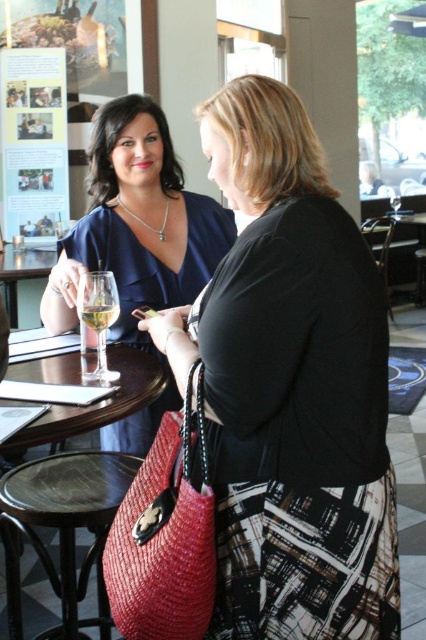
Who is positioned more to the left, clear glass wine glass at left or transparent glass table at center?

From the viewer's perspective, transparent glass table at center appears more on the left side.

Can you confirm if clear glass wine glass at left is smaller than transparent glass table at center?

Correct, clear glass wine glass at left occupies less space than transparent glass table at center.

Does point (78, 305) lie behind point (49, 248)?

No.

Where is `clear glass wine glass at left`? The width and height of the screenshot is (426, 640). clear glass wine glass at left is located at coordinates (95, 323).

From the picture: Which is above, rattan stool at lower left or transparent glass table at center?

transparent glass table at center is higher up.

Is rattan stool at lower left wider than transparent glass table at center?

In fact, rattan stool at lower left might be narrower than transparent glass table at center.

Is point (17, 528) closer to camera compared to point (13, 272)?

That is True.

What are the coordinates of `rattan stool at lower left` in the screenshot? It's located at click(x=63, y=529).

Is point (316, 556) less distant than point (140, 204)?

Yes.

Between point (380, 435) and point (126, 192), which one is positioned in front?

Positioned in front is point (380, 435).

Image resolution: width=426 pixels, height=640 pixels. Identify the location of matte black top at center. (290, 387).